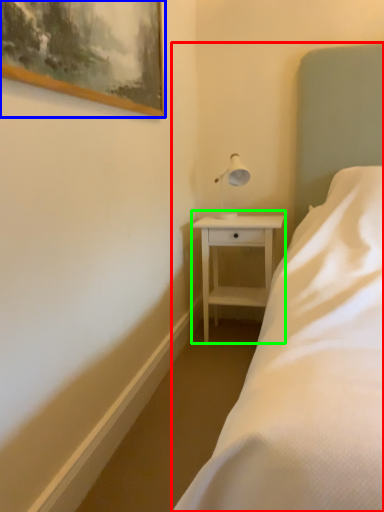
Question: Which object is the farthest from bed (highlighted by a red box)? Choose among these: picture frame (highlighted by a blue box) or nightstand (highlighted by a green box).

Choices:
 (A) picture frame
 (B) nightstand

Answer: (A)